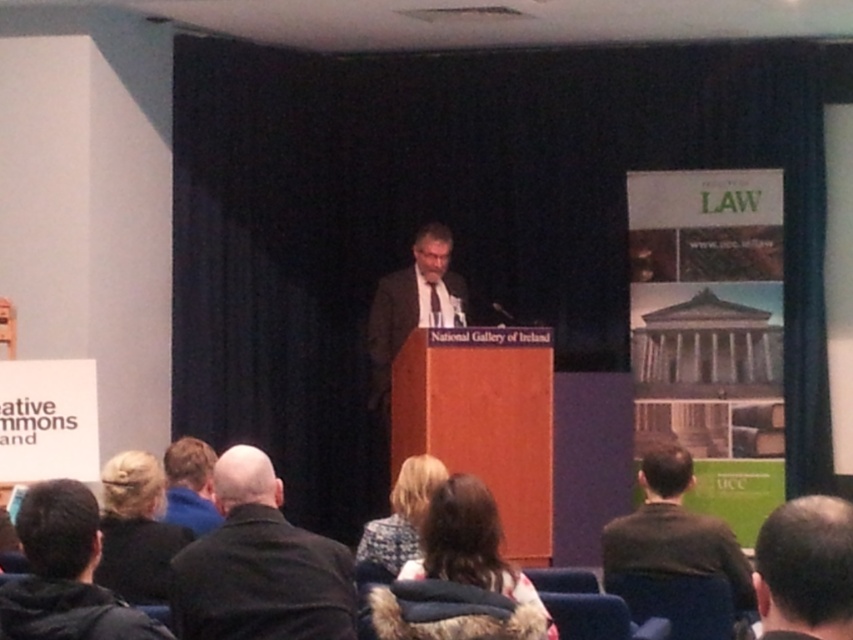
Between dark brown hair at lower left and blonde hair at lower left, which one appears on the left side from the viewer's perspective?

From the viewer's perspective, blonde hair at lower left appears more on the left side.

Is dark brown hair at lower left positioned in front of blonde hair at lower left?

Yes, it is.

The width and height of the screenshot is (853, 640). I want to click on dark brown hair at lower left, so click(65, 573).

Is patterned fabric coat at lower center below blue fleece jacket at lower left?

Yes.

You are a GUI agent. You are given a task and a screenshot of the screen. Output one action in this format:
    pyautogui.click(x=<x>, y=<y>)
    Task: Click on the patterned fabric coat at lower center
    
    Given the screenshot: What is the action you would take?
    pyautogui.click(x=399, y=518)

Is dark brown hair at lower left to the left of patterned fabric coat at lower center from the viewer's perspective?

Yes, dark brown hair at lower left is to the left of patterned fabric coat at lower center.

This screenshot has height=640, width=853. What do you see at coordinates (65, 573) in the screenshot?
I see `dark brown hair at lower left` at bounding box center [65, 573].

At what (x,y) coordinates should I click in order to perform the action: click on dark brown hair at lower left. Please return your answer as a coordinate pair (x, y). The height and width of the screenshot is (640, 853). Looking at the image, I should click on (65, 573).